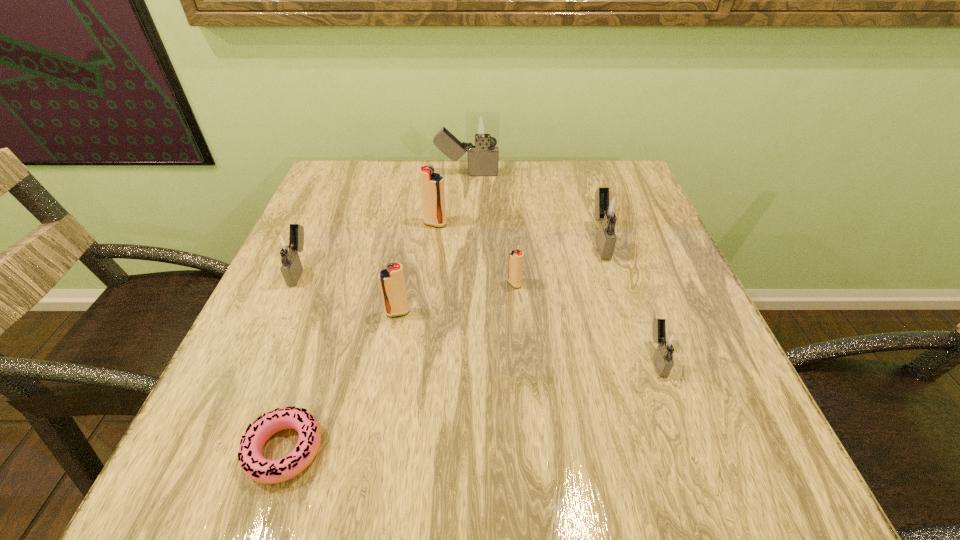
Locate an element on the screen. The height and width of the screenshot is (540, 960). free region at the left edge is located at coordinates (268, 359).

Where is `vacant area at the right edge`? vacant area at the right edge is located at coordinates (666, 273).

Image resolution: width=960 pixels, height=540 pixels. I want to click on vacant space at the far left corner of the desktop, so click(x=329, y=184).

In the image, there is a desktop. At what (x,y) coordinates should I click in order to perform the action: click on vacant space at the far right corner. Please return your answer as a coordinate pair (x, y). Looking at the image, I should click on (584, 181).

This screenshot has height=540, width=960. What are the coordinates of `free space that is in between the smallest gray igniter and the smallest red igniter` in the screenshot? It's located at (586, 320).

At what (x,y) coordinates should I click in order to perform the action: click on unoccupied area between the tallest object and the rightmost red igniter. Please return your answer as a coordinate pair (x, y). The width and height of the screenshot is (960, 540). Looking at the image, I should click on (491, 229).

Identify the location of blank region between the third smallest gray igniter and the farthest red igniter. The height and width of the screenshot is (540, 960). (517, 232).

This screenshot has width=960, height=540. In order to click on free point between the second red igniter from left to right and the second object from left to right in this screenshot , I will do `click(360, 337)`.

This screenshot has width=960, height=540. In order to click on vacant region between the sixth object from left to right and the farthest gray igniter in this screenshot , I will do `click(491, 229)`.

Locate an element on the screen. vacant region between the nearest gray igniter and the pink doughnut is located at coordinates (470, 403).